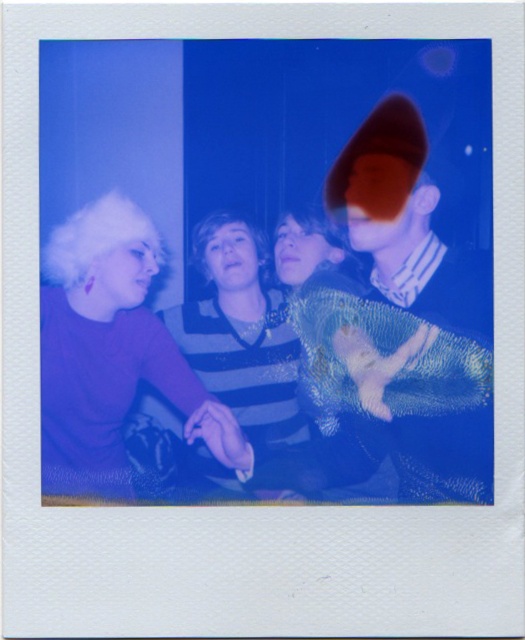
Which is more to the left, shiny metallic jacket at right or purple shiny sweater at center?

Positioned to the left is purple shiny sweater at center.

Can you confirm if shiny metallic jacket at right is positioned below purple shiny sweater at center?

Actually, shiny metallic jacket at right is above purple shiny sweater at center.

Which is behind, point (435, 460) or point (174, 330)?

The point (174, 330) is behind.

You are a GUI agent. You are given a task and a screenshot of the screen. Output one action in this format:
    pyautogui.click(x=<x>, y=<y>)
    Task: Click on the shiny metallic jacket at right
    This screenshot has width=525, height=640.
    Given the screenshot: What is the action you would take?
    pyautogui.click(x=404, y=259)

Is purple matte shirt at left below purple shiny sweater at center?

Actually, purple matte shirt at left is above purple shiny sweater at center.

Does point (79, 356) lie behind point (234, 285)?

No, (79, 356) is closer to viewer.

Which is behind, point (116, 376) or point (159, 419)?

The point (159, 419) is more distant.

You are a GUI agent. You are given a task and a screenshot of the screen. Output one action in this format:
    pyautogui.click(x=<x>, y=<y>)
    Task: Click on the purple matte shirt at left
    
    Given the screenshot: What is the action you would take?
    pyautogui.click(x=113, y=346)

Can you confirm if shiny metallic jacket at right is positioned to the left of purple matte shirt at left?

In fact, shiny metallic jacket at right is to the right of purple matte shirt at left.

The image size is (525, 640). What do you see at coordinates (404, 259) in the screenshot?
I see `shiny metallic jacket at right` at bounding box center [404, 259].

At what (x,y) coordinates should I click in order to perform the action: click on shiny metallic jacket at right. Please return your answer as a coordinate pair (x, y). Image resolution: width=525 pixels, height=640 pixels. Looking at the image, I should click on (404, 259).